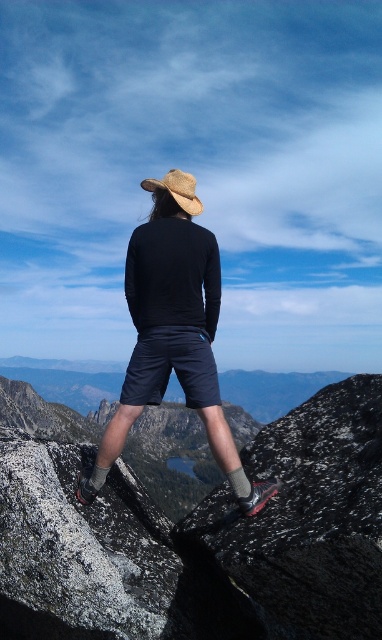
You are a photographer planning to take a portrait of the person in the scene. You want to ensure the matte black shirt at center and dark blue cotton shorts at center are both visible in the frame. Given their positions, will you need to adjust your camera angle to include both?

The matte black shirt at center is much taller than the dark blue cotton shorts at center, so you will need to adjust your camera angle to include both in the frame since the shirt is taller and might block the shorts if not angled properly.

You are a photographer trying to capture the best shot of the scene. You notice two points marked in the image. Which point, point (223, 536) or point (121, 552), is closer to your camera lens?

Point (223, 536) is closer to the camera lens than point (121, 552).